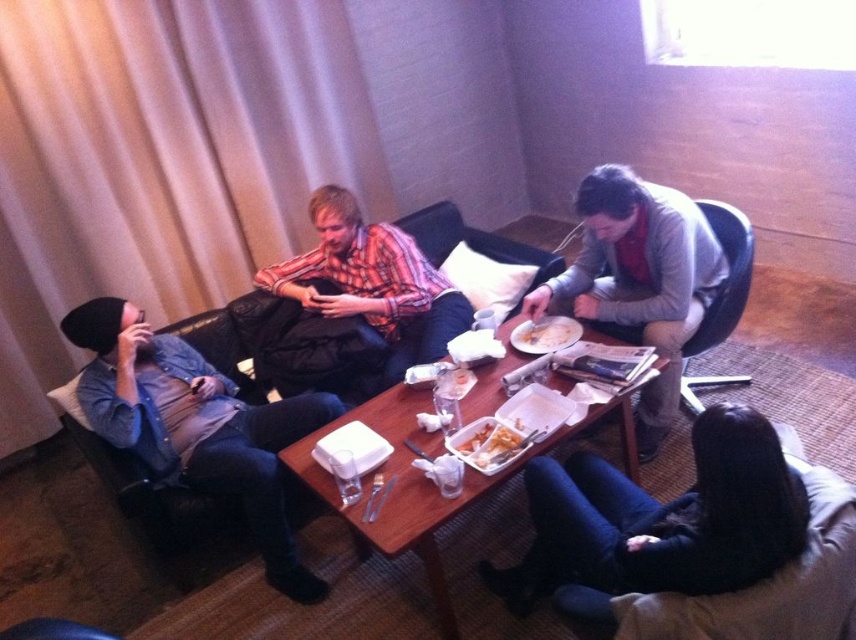
You are standing in the living room and want to reach the point marked at coordinates point (706,524). Considering the furniture arrangement, is there enough space to walk directly to that point without moving any furniture?

The distance between the viewer and point (706,524) is 5.06 feet. Since this distance is sufficient for walking, you can reach the point directly without needing to move any furniture.

You are a delivery person who needs to place a small package on either the dark blue jeans at lower right or the wooden table at center. Which surface is more suitable for placing the package?

The wooden table at center is more suitable for placing the package because the dark blue jeans at lower right is thinner than the wooden table at center, making the table a more stable and appropriate surface.

You are a delivery person who needs to place a small package between the dark blue jeans at lower right and the denim jacket at left. Can you fit it there?

The dark blue jeans at lower right and the denim jacket at left are 3.45 feet apart, so yes, the package can be placed between them as there is sufficient space.